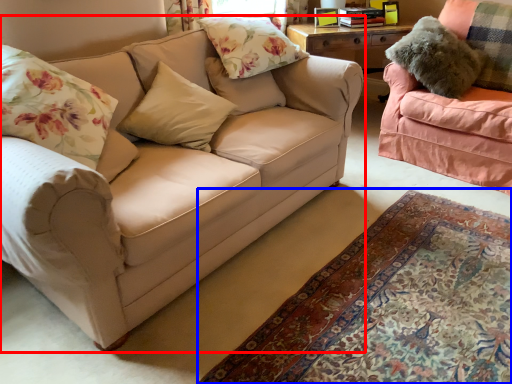
Question: Which point is closer to the camera, studio couch (highlighted by a red box) or plain (highlighted by a blue box)?

Choices:
 (A) studio couch
 (B) plain

Answer: (B)